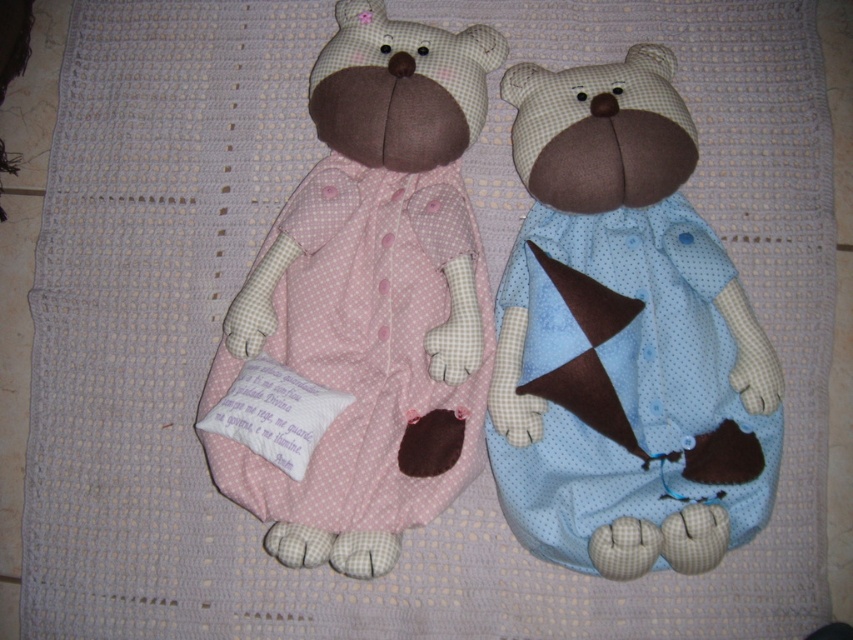
Question: Is matte blue fabric teddy bear at right below pink polka dot fabric teddy bear at center?

Choices:
 (A) no
 (B) yes

Answer: (B)

Question: Does matte blue fabric teddy bear at right lie in front of pink polka dot fabric teddy bear at center?

Choices:
 (A) no
 (B) yes

Answer: (B)

Question: Can you confirm if matte blue fabric teddy bear at right is positioned above pink polka dot fabric teddy bear at center?

Choices:
 (A) no
 (B) yes

Answer: (A)